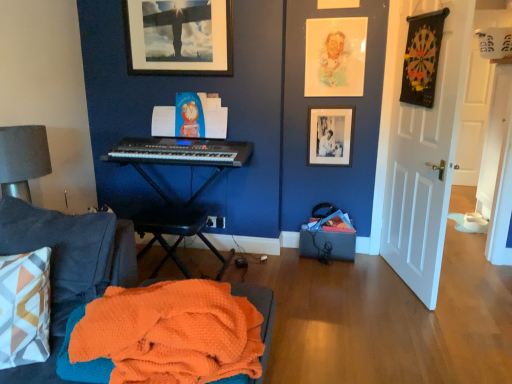
Find the location of a particular element. This screenshot has height=384, width=512. black plastic music stool at center is located at coordinates (175, 232).

The width and height of the screenshot is (512, 384). What do you see at coordinates (179, 37) in the screenshot? I see `matte black picture frame at upper center, which is the first picture frame from left to right` at bounding box center [179, 37].

The width and height of the screenshot is (512, 384). In order to click on matte black picture frame at upper center, positioned as the 2th picture frame in bottom-to-top order in this screenshot , I will do `click(179, 37)`.

The width and height of the screenshot is (512, 384). Describe the element at coordinates (336, 61) in the screenshot. I see `pastel watercolor portrait at upper center` at that location.

This screenshot has width=512, height=384. What are the coordinates of `black plastic music stool at center` in the screenshot? It's located at (175, 232).

Does white matte door at right turn towards matte black picture frame at upper center, which is the first picture frame from top to bottom?

Yes, white matte door at right is aimed at matte black picture frame at upper center, which is the first picture frame from top to bottom.

From a real-world perspective, is white matte door at right physically below matte black picture frame at upper center, the 2th picture frame from the right?

Yes, from a real-world perspective, white matte door at right is beneath matte black picture frame at upper center, the 2th picture frame from the right.

Does white matte door at right have a lesser width compared to matte black picture frame at upper center, which is the first picture frame from top to bottom?

No.

Based on the photo, considering the relative positions of white matte door at right and matte black picture frame at upper center, which is the first picture frame from left to right, in the image provided, is white matte door at right in front of matte black picture frame at upper center, which is the first picture frame from left to right,?

Yes, white matte door at right is closer to the camera.

In the scene shown: In the image, is black fabric box at lower right on the left side or the right side of black plastic keyboard at center?

black fabric box at lower right is positioned on black plastic keyboard at center's right side.

Is black fabric box at lower right smaller than black plastic keyboard at center?

Yes.

Which is nearer, (318, 233) or (153, 157)?

Point (153, 157)

Image resolution: width=512 pixels, height=384 pixels. What are the coordinates of `box located in front of the black plastic power outlet at lower center` in the screenshot? It's located at (338, 244).

Considering the sizes of black plastic power outlet at lower center and black fabric box at lower right in the image, is black plastic power outlet at lower center taller or shorter than black fabric box at lower right?

Considering their sizes, black plastic power outlet at lower center has less height than black fabric box at lower right.

Which is in front, point (222, 219) or point (306, 254)?

The point (306, 254) is in front.

Which object is closer to the camera taking this photo, black plastic power outlet at lower center or black fabric box at lower right?

black fabric box at lower right.

Considering the positions of objects black plastic keyboard at center and black plastic keyboard at center in the image provided, who is in front, black plastic keyboard at center or black plastic keyboard at center?

black plastic keyboard at center is in front.

Who is smaller, black plastic keyboard at center or black plastic keyboard at center?

black plastic keyboard at center.

Is black plastic keyboard at center surrounding black plastic keyboard at center?

No, black plastic keyboard at center is not surrounded by black plastic keyboard at center.

Which object is closer to the camera taking this photo, pastel watercolor portrait at upper center or orange waffle knit blanket at lower left?

orange waffle knit blanket at lower left is in front.

From the image's perspective, would you say pastel watercolor portrait at upper center is positioned over orange waffle knit blanket at lower left?

Yes, from the image's perspective, pastel watercolor portrait at upper center is on top of orange waffle knit blanket at lower left.

Based on the photo, from a real-world perspective, does pastel watercolor portrait at upper center stand above orange waffle knit blanket at lower left?

Yes, from a real-world perspective, pastel watercolor portrait at upper center is above orange waffle knit blanket at lower left.

Could you tell me if pastel watercolor portrait at upper center is facing orange waffle knit blanket at lower left?

Yes.

Is white matte door at right at the back of matte black picture frame at upper center, which is the first picture frame from left to right?

matte black picture frame at upper center, which is the first picture frame from left to right, does not have its back to white matte door at right.

Would you say matte black picture frame at upper center, the 2th picture frame from the right, is inside or outside white matte door at right?

matte black picture frame at upper center, the 2th picture frame from the right, is not enclosed by white matte door at right.

From the image's perspective, starting from the white matte door at right, which picture frame is the 2nd one above? Please provide its 2D coordinates.

[(179, 37)]

Looking at the image, does matte black picture frame at upper center, the 2th picture frame from the right, seem bigger or smaller compared to white matte door at right?

matte black picture frame at upper center, the 2th picture frame from the right, is smaller than white matte door at right.

Does black plastic keyboard at center have a greater width compared to pastel watercolor portrait at upper center?

Correct, the width of black plastic keyboard at center exceeds that of pastel watercolor portrait at upper center.

Based on the photo, which is closer to the camera, (158, 189) or (342, 72)?

Clearly, point (158, 189) is more distant from the camera than point (342, 72).

Which object is positioned more to the right, black plastic keyboard at center or pastel watercolor portrait at upper center?

pastel watercolor portrait at upper center is more to the right.

From the picture: Who is shorter, black plastic keyboard at center or pastel watercolor portrait at upper center?

pastel watercolor portrait at upper center is shorter.

Find the location of `door below the matte black picture frame at upper center, the 2th picture frame from the right (from the image's perspective)`. door below the matte black picture frame at upper center, the 2th picture frame from the right (from the image's perspective) is located at coordinates (423, 153).

The image size is (512, 384). Find the location of `box behind the black plastic keyboard at center`. box behind the black plastic keyboard at center is located at coordinates (338, 244).

Based on their spatial positions, is black matte picture frame at upper right, which is the 1th picture frame in right-to-left order, or white matte door at right closer to pastel watercolor portrait at upper center?

Based on the image, black matte picture frame at upper right, which is the 1th picture frame in right-to-left order, appears to be nearer to pastel watercolor portrait at upper center.

From the image, which object appears to be nearer to black plastic music stool at center, white matte door at right or pastel watercolor portrait at upper center?

Among the two, pastel watercolor portrait at upper center is located nearer to black plastic music stool at center.

Consider the image. Looking at the image, which one is located closer to black plastic keyboard at center, pastel watercolor portrait at upper center or black plastic music stool at center?

black plastic music stool at center.

Considering their positions, is black plastic keyboard at center positioned closer to black plastic music stool at center than black plastic power outlet at lower center?

black plastic keyboard at center is positioned closer to the anchor black plastic music stool at center.

Looking at the image, which one is located further to black plastic power outlet at lower center, orange waffle knit blanket at lower left or black fabric box at lower right?

orange waffle knit blanket at lower left is further to black plastic power outlet at lower center.

Which object lies nearer to the anchor point black fabric box at lower right, black plastic power outlet at lower center or pastel watercolor portrait at upper center?

black plastic power outlet at lower center lies closer to black fabric box at lower right than the other object.

From the image, which object appears to be nearer to black plastic keyboard at center, white matte door at right or black plastic power outlet at lower center?

black plastic power outlet at lower center lies closer to black plastic keyboard at center than the other object.

Based on the photo, which object lies further to the anchor point white matte door at right, black plastic keyboard at center or black plastic music stool at center?

Based on the image, black plastic music stool at center appears to be further to white matte door at right.

Locate an element on the screen. The height and width of the screenshot is (384, 512). picture frame between pastel watercolor portrait at upper center and black fabric box at lower right in the up-down direction is located at coordinates [x=330, y=136].

Locate an element on the screen. piano positioned between black plastic keyboard at center and black plastic power outlet at lower center from near to far is located at coordinates click(167, 196).

Locate an element on the screen. Image resolution: width=512 pixels, height=384 pixels. musical keyboard situated between black plastic music stool at center and white matte door at right from left to right is located at coordinates (180, 152).

You are a GUI agent. You are given a task and a screenshot of the screen. Output one action in this format:
    pyautogui.click(x=<x>, y=<y>)
    Task: Click on the person between orange waffle knit blanket at lower left and black matte picture frame at upper right, the second picture frame viewed from the left, from front to back
    The height and width of the screenshot is (384, 512).
    Given the screenshot: What is the action you would take?
    pyautogui.click(x=336, y=61)